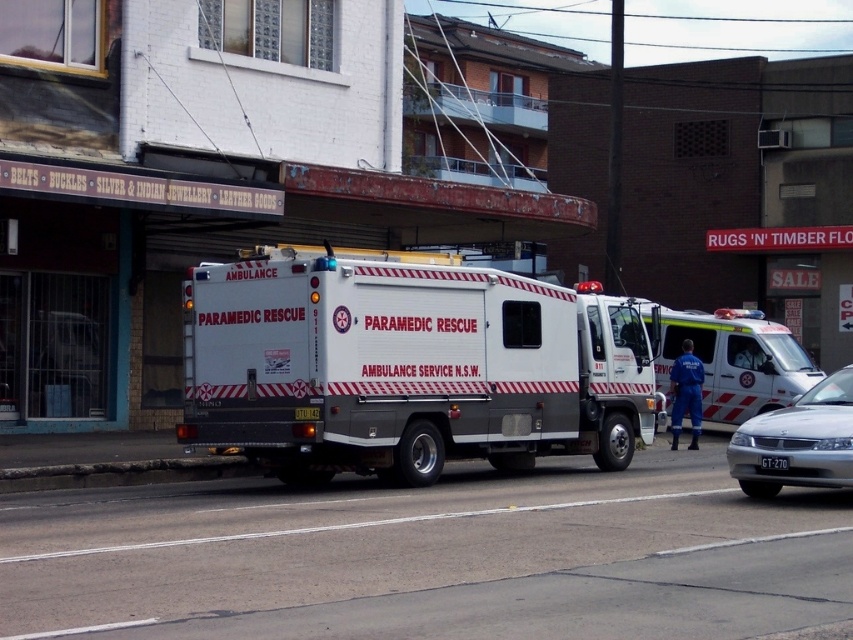
Question: Is white matte paramedic rescue vehicle at center further to the viewer compared to white matte ambulance at center?

Choices:
 (A) no
 (B) yes

Answer: (A)

Question: Based on their relative distances, which object is farther from the white matte ambulance at center?

Choices:
 (A) silver metallic sedan at center
 (B) white matte paramedic rescue vehicle at center

Answer: (B)

Question: Which of these objects is positioned farthest from the silver metallic sedan at center?

Choices:
 (A) white matte ambulance at center
 (B) white matte paramedic rescue vehicle at center

Answer: (A)

Question: Observing the image, what is the correct spatial positioning of white matte paramedic rescue vehicle at center in reference to white matte ambulance at center?

Choices:
 (A) right
 (B) left

Answer: (B)

Question: Considering the relative positions of white matte paramedic rescue vehicle at center and silver metallic sedan at center in the image provided, where is white matte paramedic rescue vehicle at center located with respect to silver metallic sedan at center?

Choices:
 (A) below
 (B) above

Answer: (B)

Question: Which object is the closest to the white matte paramedic rescue vehicle at center?

Choices:
 (A) white matte ambulance at center
 (B) silver metallic sedan at center

Answer: (B)